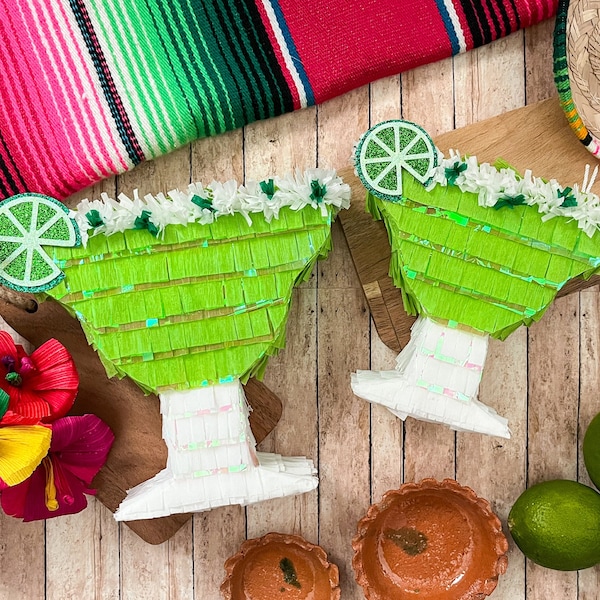
Locate an element on the screen. The width and height of the screenshot is (600, 600). top of stem of margarita glass is located at coordinates (455, 322), (201, 382).